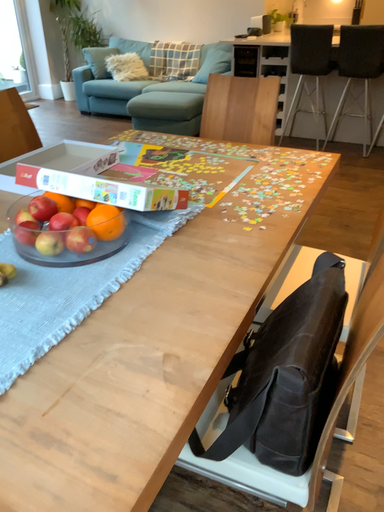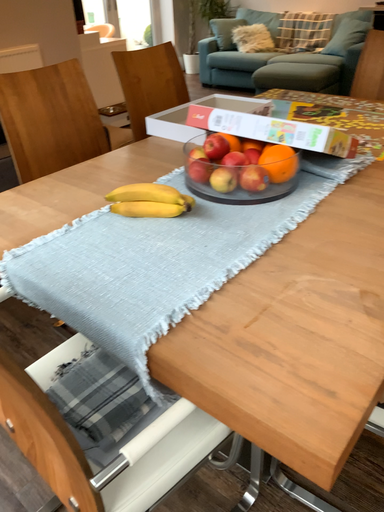
Question: Which way did the camera rotate in the video?

Choices:
 (A) rotated right
 (B) rotated left

Answer: (B)